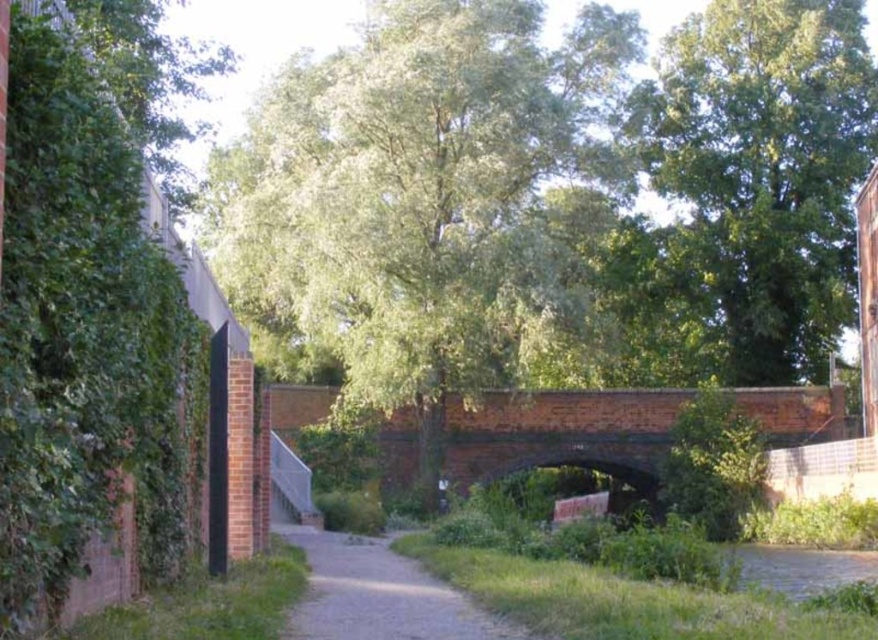
You are standing on the pathway and notice two green leafy trees in the scene. Which tree, the green leafy tree at center or the green leafy tree at upper center, is positioned lower in the image?

The green leafy tree at center is positioned lower in the image compared to the green leafy tree at upper center.

Based on the photo, you are standing at the entrance of the pathway in the outdoor scene. You want to walk straight towards the green leafy tree at center. What coordinate point should you aim for?

The green leafy tree at center is located at coordinate point (430, 198), so you should aim for that point to reach it directly.